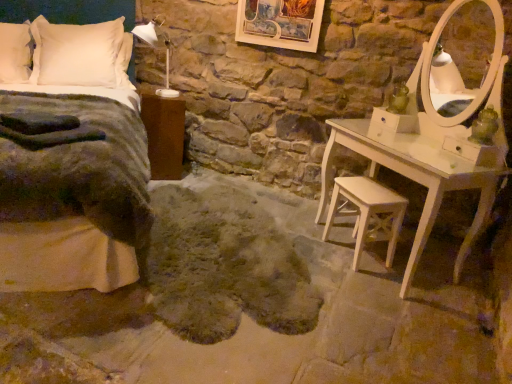
Find the location of a particular element. blank space above white wood stool at lower right (from a real-world perspective) is located at coordinates (371, 195).